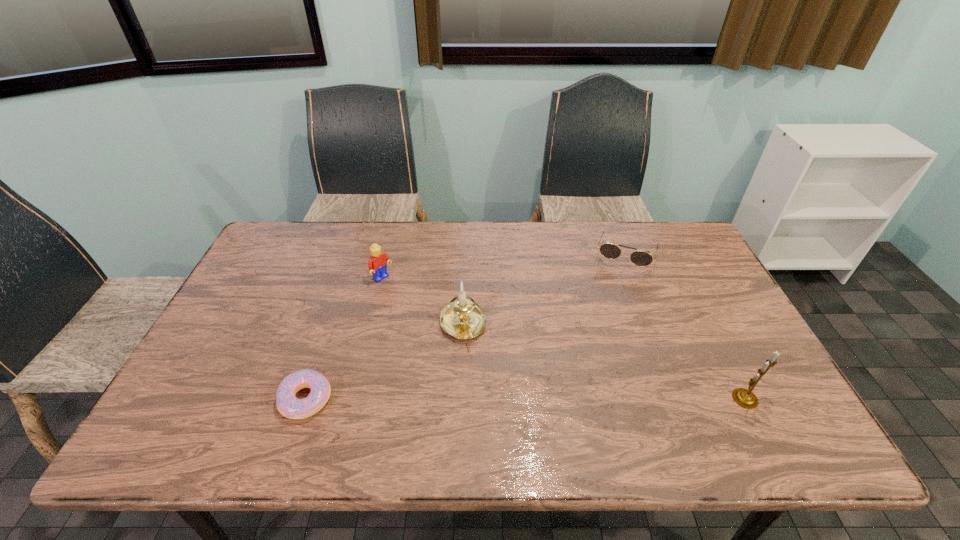
Find the location of a particular element. vacant space at the near left corner of the desktop is located at coordinates (205, 415).

Locate an element on the screen. The width and height of the screenshot is (960, 540). free spot at the far right corner of the desktop is located at coordinates (688, 237).

Where is `free space between the second shortest object and the nearer candle holder`? free space between the second shortest object and the nearer candle holder is located at coordinates (685, 327).

What are the coordinates of `vacant point located between the farther candle holder and the fourth tallest object` in the screenshot? It's located at (544, 290).

Where is `free space between the shortest object and the Lego`? free space between the shortest object and the Lego is located at coordinates (344, 339).

Where is `free space between the fourth shortest object and the second object from left to right`? The width and height of the screenshot is (960, 540). free space between the fourth shortest object and the second object from left to right is located at coordinates (422, 302).

Find the location of `vacant space that is in between the nearer candle holder and the fourth tallest object`. vacant space that is in between the nearer candle holder and the fourth tallest object is located at coordinates (685, 327).

You are a GUI agent. You are given a task and a screenshot of the screen. Output one action in this format:
    pyautogui.click(x=<x>, y=<y>)
    Task: Click on the vacant space that is in between the farther candle holder and the second shortest object
    The width and height of the screenshot is (960, 540).
    Given the screenshot: What is the action you would take?
    pyautogui.click(x=544, y=290)

Find the location of a particular element. The width and height of the screenshot is (960, 540). unoccupied area between the farther candle holder and the nearer candle holder is located at coordinates (604, 362).

Locate an element on the screen. The width and height of the screenshot is (960, 540). free space between the doughnut and the shorter candle holder is located at coordinates (384, 362).